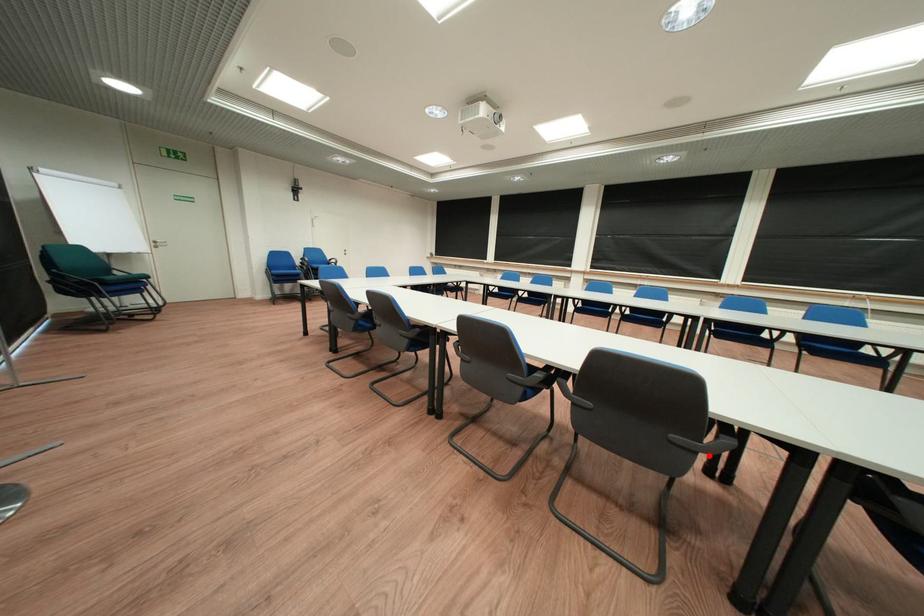
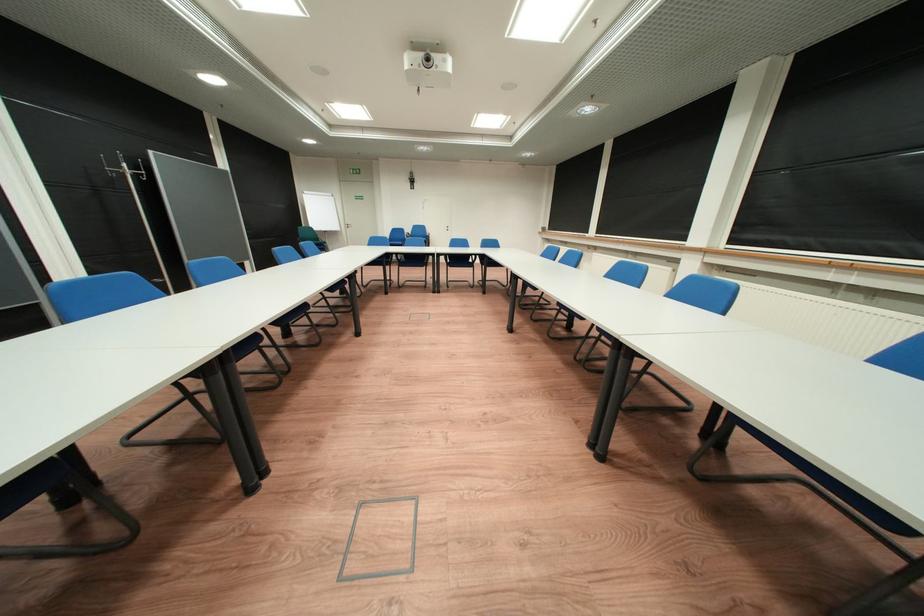
Question: I am providing you with two images of the same scene from different viewpoints. A red point is marked on the first image. Can you still see the location of the red point in image 2?

Choices:
 (A) Yes
 (B) No

Answer: (B)